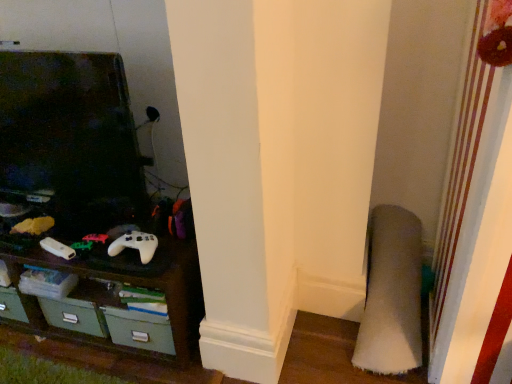
Question: Is white matte game controller at lower left, the second game controller positioned from the right, inside the boundaries of soft gray carpet at lower right, or outside?

Choices:
 (A) outside
 (B) inside

Answer: (A)

Question: Considering their positions, is white matte game controller at lower left, arranged as the 1th game controller when viewed from the left, located in front of or behind soft gray carpet at lower right?

Choices:
 (A) front
 (B) behind

Answer: (B)

Question: Estimate the real-world distances between objects in this image. Which object is closer to the dark wood shelf at lower left?

Choices:
 (A) soft gray carpet at lower right
 (B) white matte game controller at center, which ranks as the 1th game controller in right-to-left order
 (C) white matte game controller at lower left, arranged as the 1th game controller when viewed from the left

Answer: (B)

Question: Which object is the farthest from the white matte game controller at lower left, the second game controller positioned from the right?

Choices:
 (A) white matte game controller at center, which ranks as the 1th game controller in right-to-left order
 (B) dark wood shelf at lower left
 (C) soft gray carpet at lower right

Answer: (C)